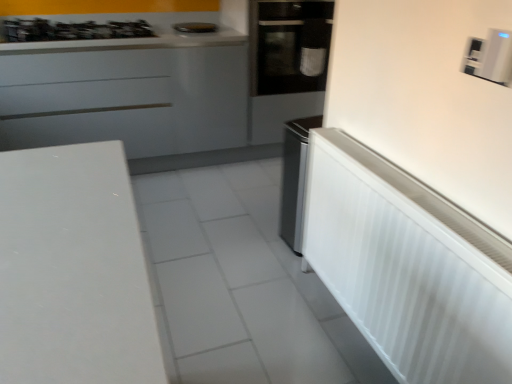
Question: Can you confirm if white plastic radiator at right, which appears as the 2th appliance when viewed from the left, is positioned to the right of black glass oven at center?

Choices:
 (A) yes
 (B) no

Answer: (A)

Question: Is white plastic radiator at right, which ranks as the 1th appliance in front-to-back order, wider than black glass oven at center?

Choices:
 (A) yes
 (B) no

Answer: (B)

Question: From the image's perspective, would you say white plastic radiator at right, the second appliance in the right-to-left sequence, is positioned over black glass oven at center?

Choices:
 (A) yes
 (B) no

Answer: (B)

Question: Considering the relative sizes of white plastic radiator at right, the third appliance positioned from the back, and black glass oven at center in the image provided, is white plastic radiator at right, the third appliance positioned from the back, thinner than black glass oven at center?

Choices:
 (A) yes
 (B) no

Answer: (A)

Question: From the image's perspective, is white plastic radiator at right, positioned as the 3th appliance in top-to-bottom order, beneath black glass oven at center?

Choices:
 (A) no
 (B) yes

Answer: (B)

Question: In the image, is metallic silver gas stove at upper left positioned in front of or behind white plastic thermostat at upper right, the second appliance positioned from the back?

Choices:
 (A) front
 (B) behind

Answer: (B)

Question: From the image's perspective, relative to white plastic thermostat at upper right, the second appliance in the top-to-bottom sequence, is metallic silver gas stove at upper left above or below?

Choices:
 (A) above
 (B) below

Answer: (A)

Question: Is point pos(108,26) closer or farther from the camera than point pos(480,69)?

Choices:
 (A) farther
 (B) closer

Answer: (A)

Question: From a real-world perspective, relative to white plastic thermostat at upper right, which is the second appliance from front to back, is metallic silver gas stove at upper left vertically above or below?

Choices:
 (A) above
 (B) below

Answer: (B)

Question: Is point (207, 64) positioned closer to the camera than point (84, 33)?

Choices:
 (A) farther
 (B) closer

Answer: (B)

Question: Is white glossy cabinet at upper left inside or outside of metallic silver gas stove at upper left?

Choices:
 (A) inside
 (B) outside

Answer: (B)

Question: From a real-world perspective, is white glossy cabinet at upper left above or below metallic silver gas stove at upper left?

Choices:
 (A) above
 (B) below

Answer: (B)

Question: Is white glossy cabinet at upper left taller or shorter than metallic silver gas stove at upper left?

Choices:
 (A) short
 (B) tall

Answer: (B)

Question: From a real-world perspective, is metallic silver toaster at upper center, arranged as the third appliance when ordered from the bottom, above or below black glass oven at center?

Choices:
 (A) above
 (B) below

Answer: (A)

Question: From the image's perspective, is metallic silver toaster at upper center, the 1th appliance from the left, above or below black glass oven at center?

Choices:
 (A) above
 (B) below

Answer: (A)